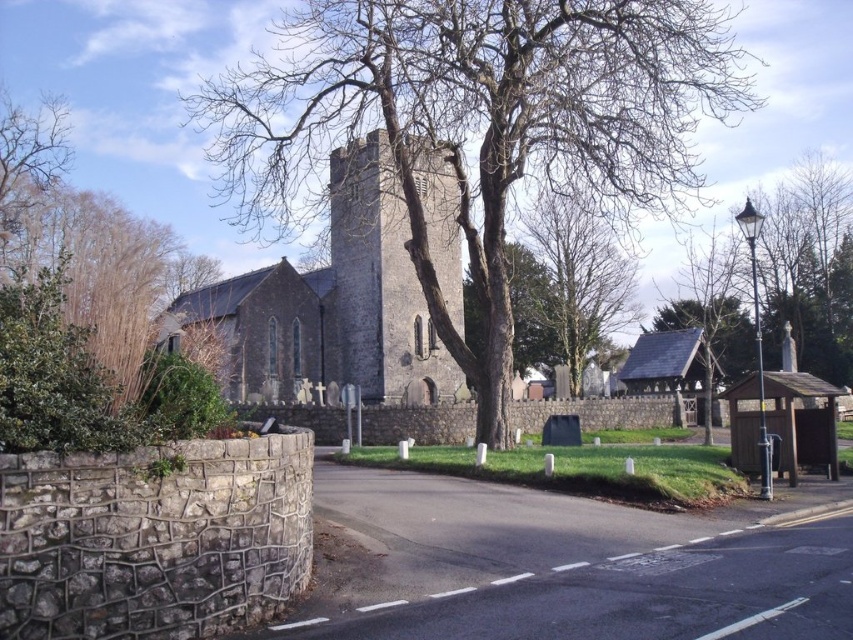
The height and width of the screenshot is (640, 853). What do you see at coordinates (476, 124) in the screenshot? I see `bare branches at center` at bounding box center [476, 124].

Can you confirm if bare branches at center is bigger than bare wood tree at center?

Yes.

Does point (206, 90) come closer to viewer compared to point (619, 314)?

No, it is behind (619, 314).

This screenshot has height=640, width=853. Identify the location of bare branches at center. (476, 124).

Does gray stone church at center have a greater height compared to bare wood tree at center?

Yes, gray stone church at center is taller than bare wood tree at center.

Between gray stone church at center and bare wood tree at center, which one appears on the right side from the viewer's perspective?

bare wood tree at center

At what (x,y) coordinates should I click in order to perform the action: click on gray stone church at center. Please return your answer as a coordinate pair (x, y). Looking at the image, I should click on (332, 304).

Can you confirm if bare branches at center is shorter than gray stone tower at center?

Incorrect, bare branches at center's height does not fall short of gray stone tower at center's.

Between point (476, 40) and point (367, 371), which one is positioned behind?

Positioned behind is point (367, 371).

Where is `bare branches at center`? bare branches at center is located at coordinates (476, 124).